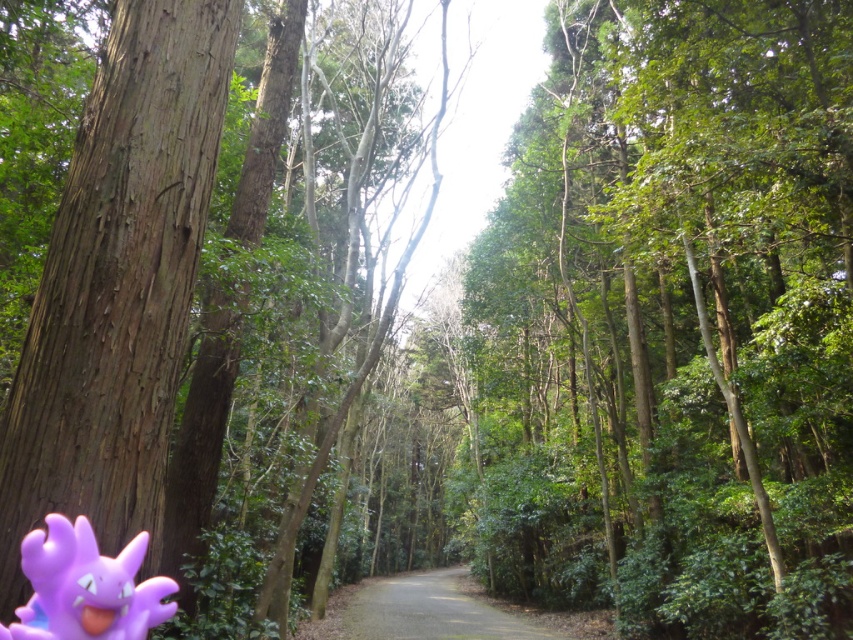
You are a hiker who wants to place the purple rubber toy at lower left on the gravel road at center. Considering their sizes, will the toy fit entirely on the road without any part hanging off?

The purple rubber toy at lower left is smaller than the gravel road at center, so it will fit entirely on the road without any part hanging off.